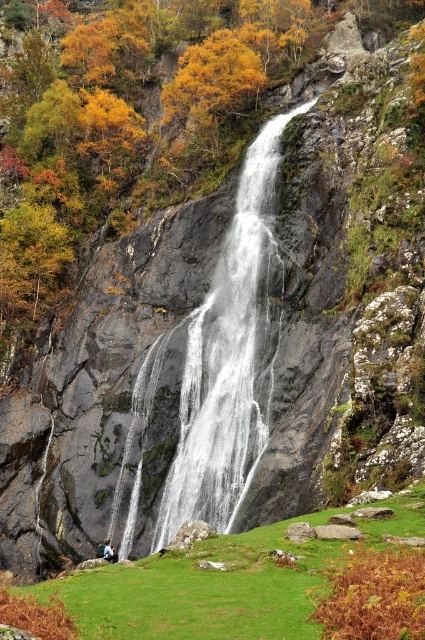
Describe the element at coordinates (227, 358) in the screenshot. The width and height of the screenshot is (425, 640). I see `white frothy water at center` at that location.

Is point (271, 260) positioned before point (107, 552)?

No.

Where is `white frothy water at center`? white frothy water at center is located at coordinates (227, 358).

Does white frothy water at center lie behind green grassy at lower center?

Yes, it is behind green grassy at lower center.

This screenshot has height=640, width=425. I want to click on white frothy water at center, so click(x=227, y=358).

Where is `white frothy water at center`? The width and height of the screenshot is (425, 640). white frothy water at center is located at coordinates (227, 358).

Can you confirm if green grassy at lower center is smaller than blue denim jacket at lower center?

Actually, green grassy at lower center might be larger than blue denim jacket at lower center.

Is green grassy at lower center bigger than blue denim jacket at lower center?

Yes.

Does point (76, 612) come in front of point (113, 550)?

Yes.

Locate an element on the screen. green grassy at lower center is located at coordinates (203, 592).